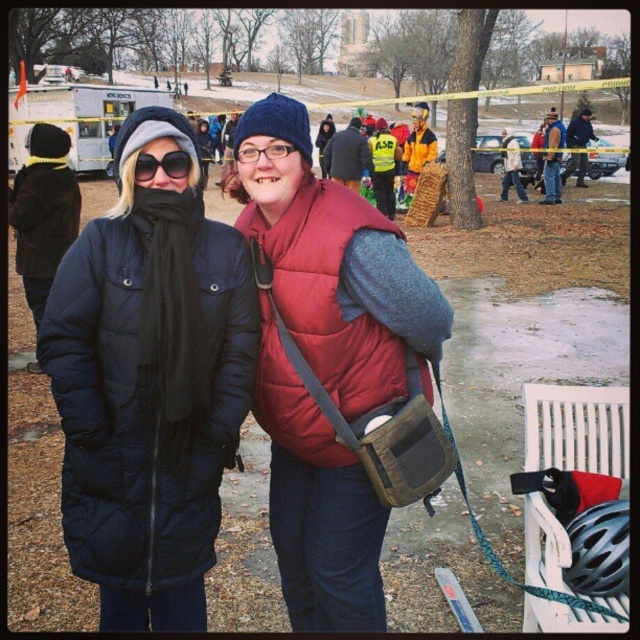
Question: Does white plastic park bench at lower right appear over matte blue jacket at center?

Choices:
 (A) no
 (B) yes

Answer: (A)

Question: Among these points, which one is nearest to the camera?

Choices:
 (A) (545, 202)
 (B) (598, 458)
 (C) (323, 157)
 (D) (416, 156)

Answer: (B)

Question: Estimate the real-world distances between objects in this image. Which object is farther from the clear plastic glasses at center?

Choices:
 (A) black matte sunglasses at center
 (B) matte black coat at center

Answer: (B)

Question: Among these points, which one is nearest to the camera?

Choices:
 (A) (529, 440)
 (B) (509, 170)
 (C) (563, 134)

Answer: (A)

Question: Does matte blue jacket at center appear over light brown leather jacket at center?

Choices:
 (A) no
 (B) yes

Answer: (A)

Question: Where is black matte bicycle helmet at lower right located in relation to matte blue jacket at center in the image?

Choices:
 (A) above
 (B) below

Answer: (B)